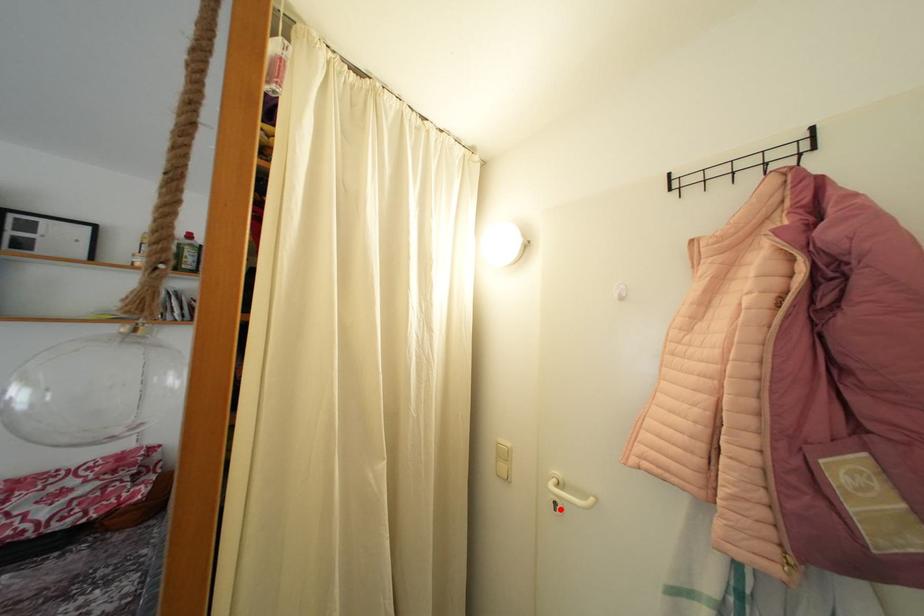
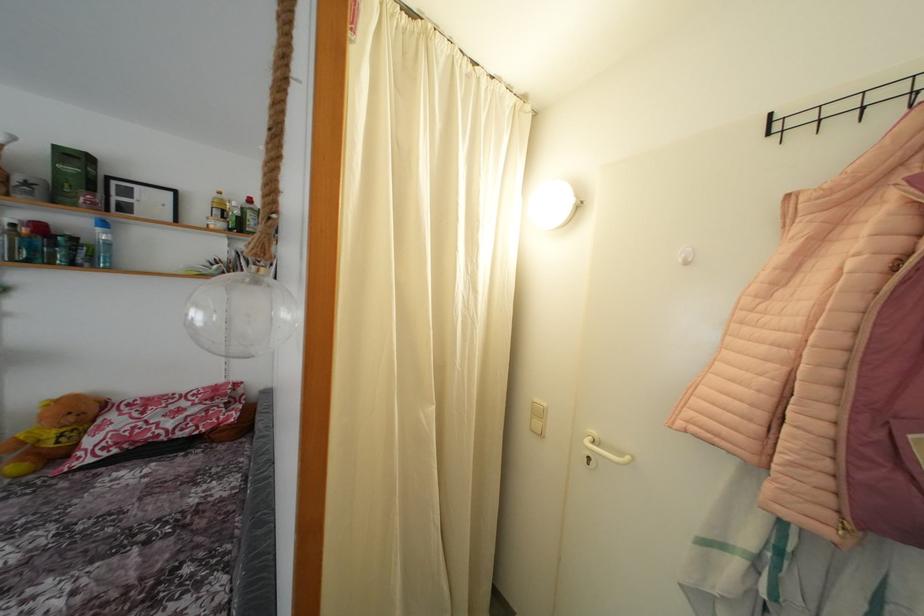
Find the pixel in the second image that matches the highlighted location in the first image.

(593, 464)